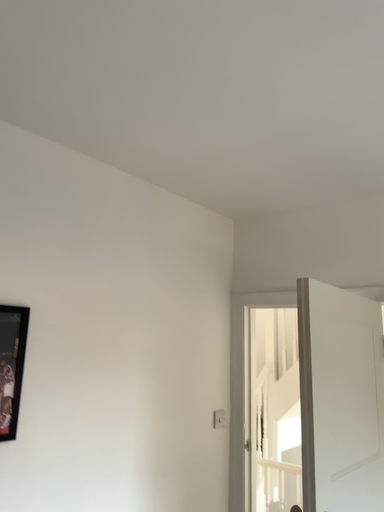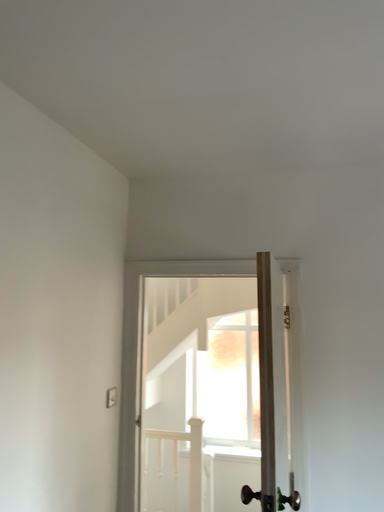
Question: How did the camera likely rotate when shooting the video?

Choices:
 (A) rotated left
 (B) rotated right

Answer: (B)